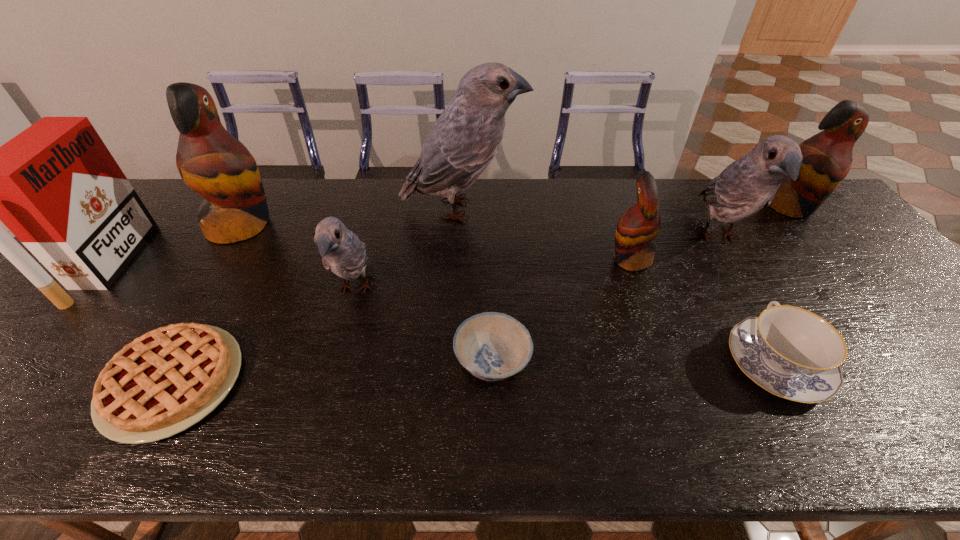
Find the location of a particular element. This screenshot has height=540, width=960. vacant point at the left edge is located at coordinates (156, 235).

You are a GUI agent. You are given a task and a screenshot of the screen. Output one action in this format:
    pyautogui.click(x=<x>, y=<y>)
    Task: Click on the free space at the right edge
    
    Given the screenshot: What is the action you would take?
    pyautogui.click(x=813, y=253)

Find the location of `free space between the second red parrot from right to left and the blue chinaware`. free space between the second red parrot from right to left and the blue chinaware is located at coordinates (703, 311).

Locate an element on the screen. The width and height of the screenshot is (960, 540). unoccupied position between the eighth tallest object and the second biggest red parrot is located at coordinates (783, 285).

You are a GUI agent. You are given a task and a screenshot of the screen. Output one action in this format:
    pyautogui.click(x=<x>, y=<y>)
    Task: Click on the vacant space that is in between the blue bowl and the fourth object from left to right
    
    Given the screenshot: What is the action you would take?
    pyautogui.click(x=424, y=325)

Identify the location of vacant area between the blue bowl and the tan pie. [x=333, y=371].

This screenshot has width=960, height=540. Find the location of `vacant area that lies between the fourth object from right to left and the second gray parrot from right to left`. vacant area that lies between the fourth object from right to left and the second gray parrot from right to left is located at coordinates (546, 234).

At what (x,y) coordinates should I click in order to perform the action: click on vacant space that is in between the second smallest gray parrot and the red cigarette case. Please return your answer as a coordinate pair (x, y). The height and width of the screenshot is (540, 960). Looking at the image, I should click on (414, 251).

You are a GUI agent. You are given a task and a screenshot of the screen. Output one action in this format:
    pyautogui.click(x=<x>, y=<y>)
    Task: Click on the free space between the rightmost gray parrot and the chinaware
    The width and height of the screenshot is (960, 540).
    Given the screenshot: What is the action you would take?
    pyautogui.click(x=747, y=301)

I want to click on free space between the second shortest object and the second biggest gray parrot, so click(x=605, y=299).